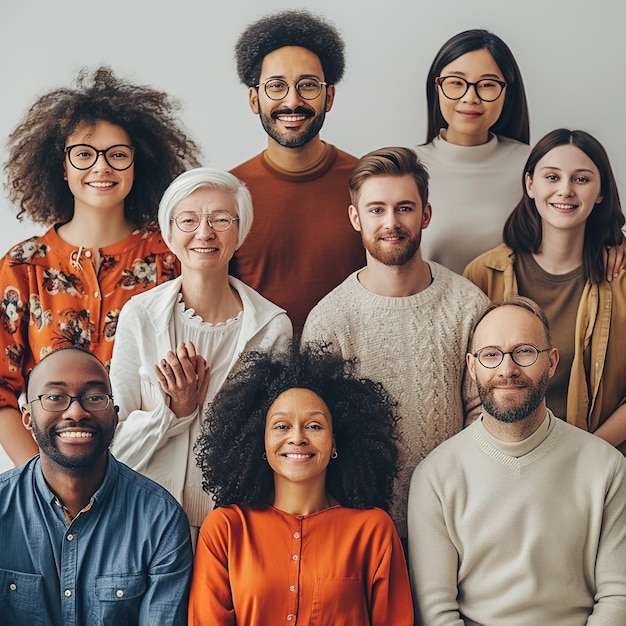
Identify the location of family photo. Image resolution: width=626 pixels, height=626 pixels. (86, 501), (299, 525), (495, 499), (206, 297), (394, 292), (558, 254), (116, 201), (285, 177), (464, 156).